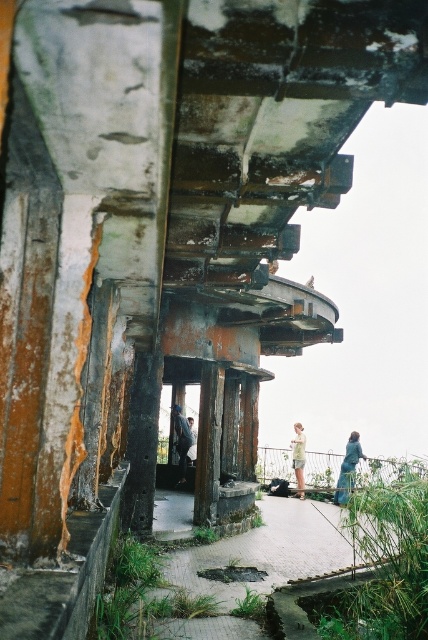
You are a maintenance worker tasked with placing a 2 meter wide equipment on the paved stone path at center. The equipment requires a clear space equal to its width. Can you safely place it there without encroaching on the dark gray concrete pillar at center?

The paved stone path at center might be wider than dark gray concrete pillar at center. Since the equipment requires a clear space equal to its width, which is 2 meters, it depends on the actual width of the path. If the path is indeed wider than the pillar, it could potentially accommodate the equipment. However, without exact measurements, there is uncertainty. Proceed with caution and ensure sufficient space before placing the equipment.

You are a hiker who has just arrived at the abandoned watchtower. You see a paved stone path at center and a blue denim jacket at lower right. Which object takes up more space in the scene?

The paved stone path at center takes up more space in the scene compared to the blue denim jacket at lower right because it has a larger size.